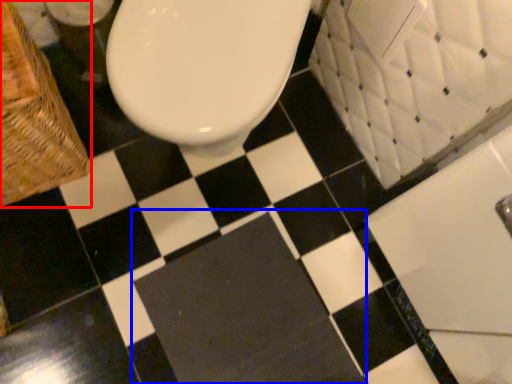
Question: Which object is further to the camera taking this photo, basket (highlighted by a red box) or bath mat (highlighted by a blue box)?

Choices:
 (A) basket
 (B) bath mat

Answer: (B)